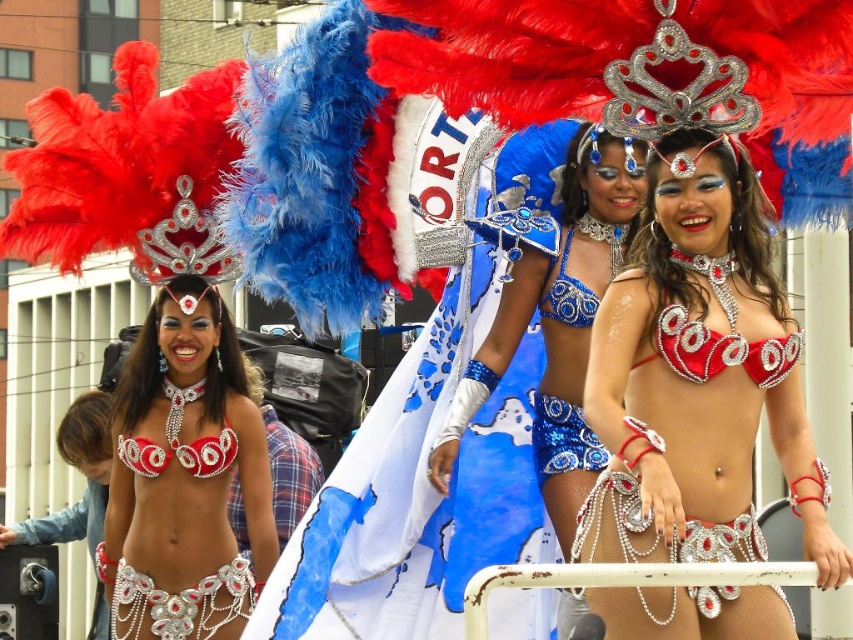
Is shiny red bikini at center shorter than matte silver bikini top at left?

In fact, shiny red bikini at center may be taller than matte silver bikini top at left.

Which is more to the left, shiny red bikini at center or matte silver bikini top at left?

matte silver bikini top at left

The width and height of the screenshot is (853, 640). Identify the location of shiny red bikini at center. [697, 378].

Who is positioned more to the right, shiny red bikini at center or shiny blue sequins bikini top at center?

From the viewer's perspective, shiny red bikini at center appears more on the right side.

Locate an element on the screen. Image resolution: width=853 pixels, height=640 pixels. shiny red bikini at center is located at coordinates (697, 378).

The width and height of the screenshot is (853, 640). Find the location of `shiny red bikini at center`. shiny red bikini at center is located at coordinates (697, 378).

From the picture: Is shiny red bikini at center closer to the viewer compared to shiny blue bikini top at center?

Yes, it is.

Does shiny red bikini at center have a larger size compared to shiny blue bikini top at center?

Indeed, shiny red bikini at center has a larger size compared to shiny blue bikini top at center.

Is point (692, 323) in front of point (550, 499)?

That is True.

Where is `shiny red bikini at center`? shiny red bikini at center is located at coordinates (697, 378).